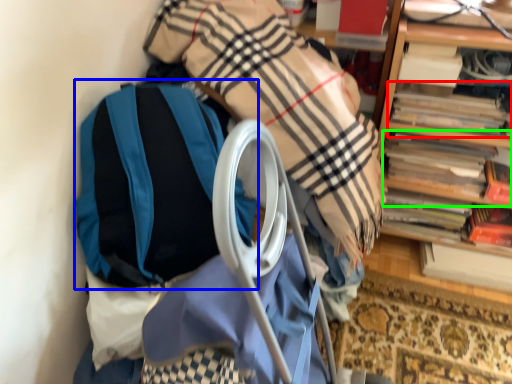
Question: Considering the real-world distances, which object is farthest from book (highlighted by a red box)? backpack (highlighted by a blue box) or book (highlighted by a green box)?

Choices:
 (A) backpack
 (B) book

Answer: (A)